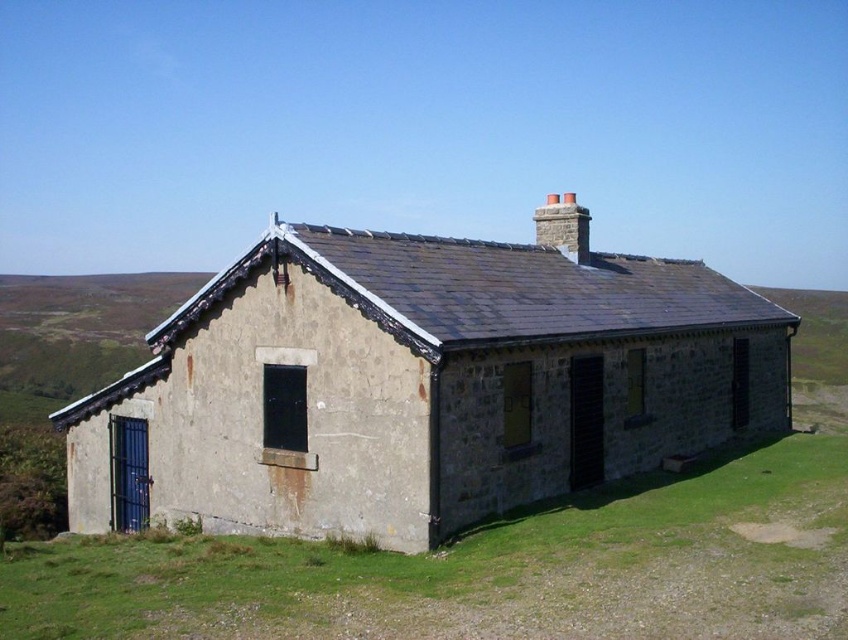
You are standing in the middle of a field and see the rustic stone cottage at center and the green grass at lower center. Which object is taller?

The rustic stone cottage at center is taller than the green grass at lower center.

You are standing in the middle of the field and see the rustic stone cottage at center and the green grass at lower center. Which object is wider?

The rustic stone cottage at center is wider than the green grass at lower center.